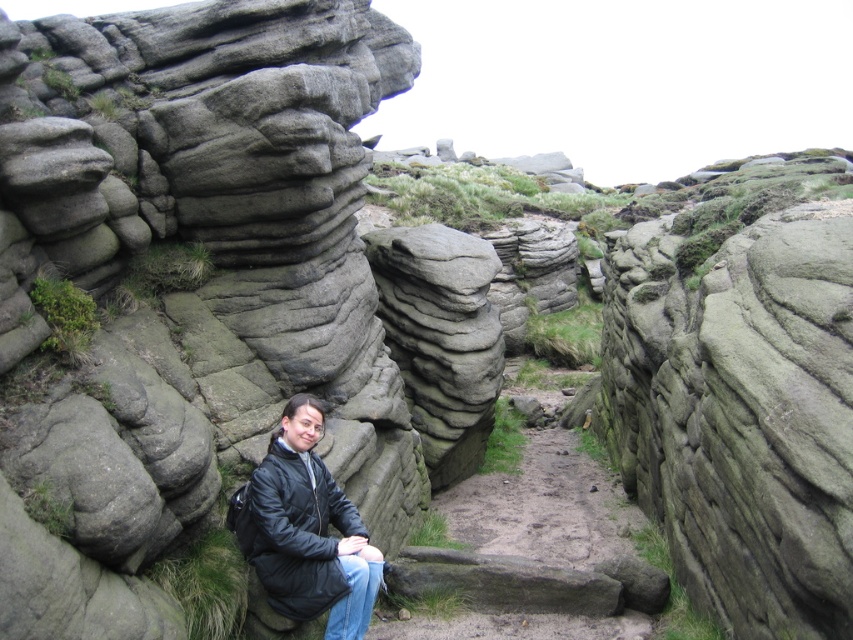
Who is positioned more to the left, dull gray stone path at center or black matte jacket at center?

black matte jacket at center

Does dull gray stone path at center lie in front of black matte jacket at center?

That is False.

Is point (527, 502) positioned in front of point (334, 544)?

No, it is behind (334, 544).

At what (x,y) coordinates should I click in order to perform the action: click on dull gray stone path at center. Please return your answer as a coordinate pair (x, y). Looking at the image, I should click on (532, 554).